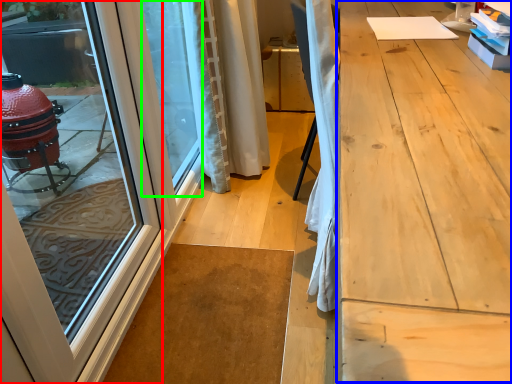
Question: Based on their relative distances, which object is nearer to door (highlighted by a red box)? Choose from workbench (highlighted by a blue box) and window screen (highlighted by a green box).

Choices:
 (A) workbench
 (B) window screen

Answer: (B)